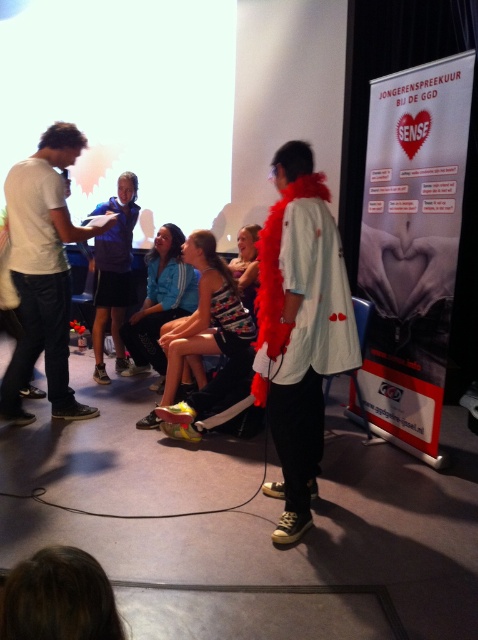
At what (x,y) coordinates should I click in order to perform the action: click on matte blue jacket at center. Please return your answer as a coordinate pair (x, y). Image resolution: width=478 pixels, height=640 pixels. Looking at the image, I should click on (203, 324).

Between matte blue jacket at center and dark blue shirt at center, which one is positioned higher?

dark blue shirt at center is higher up.

Find the location of a particular element. This screenshot has width=478, height=640. matte blue jacket at center is located at coordinates (203, 324).

Where is `matte blue jacket at center`? The image size is (478, 640). matte blue jacket at center is located at coordinates (203, 324).

Does blue fabric jacket at center appear under dark blue shirt at center?

Indeed, blue fabric jacket at center is positioned under dark blue shirt at center.

Identify the location of blue fabric jacket at center. This screenshot has height=640, width=478. (160, 301).

Where is `blue fabric jacket at center`? The height and width of the screenshot is (640, 478). blue fabric jacket at center is located at coordinates (160, 301).

Is white cotton shirt at left smaller than dark blue shirt at center?

No.

This screenshot has height=640, width=478. What do you see at coordinates (43, 272) in the screenshot?
I see `white cotton shirt at left` at bounding box center [43, 272].

Between point (76, 404) and point (131, 204), which one is positioned behind?

The point (131, 204) is behind.

Identify the location of white cotton shirt at left. (43, 272).